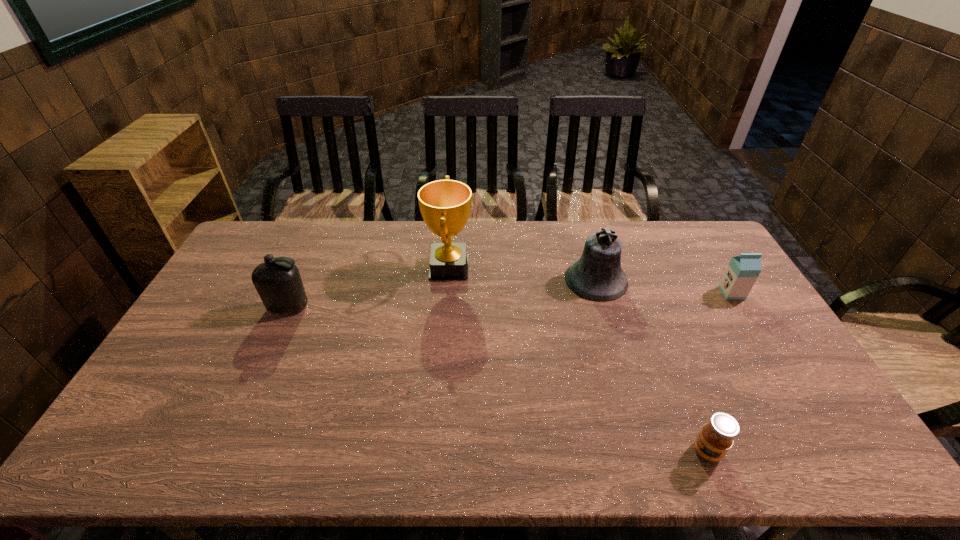
At what (x,y) coordinates should I click in order to perform the action: click on empty space between the award and the leftmost object. Please return your answer as a coordinate pair (x, y). The height and width of the screenshot is (540, 960). Looking at the image, I should click on (369, 287).

The height and width of the screenshot is (540, 960). In order to click on free spot between the fourth object from left to right and the bottle in this screenshot , I will do `click(497, 380)`.

You are a GUI agent. You are given a task and a screenshot of the screen. Output one action in this format:
    pyautogui.click(x=<x>, y=<y>)
    Task: Click on the free area in between the fourth tallest object and the leftmost object
    The width and height of the screenshot is (960, 540).
    Given the screenshot: What is the action you would take?
    pyautogui.click(x=510, y=300)

You are a GUI agent. You are given a task and a screenshot of the screen. Output one action in this format:
    pyautogui.click(x=<x>, y=<y>)
    Task: Click on the object that is the third nearest to the second object from right to left
    The image size is (960, 540).
    Given the screenshot: What is the action you would take?
    pos(445,205)

In order to click on object that is the fourth closest to the leftmost object in this screenshot , I will do `click(742, 271)`.

The image size is (960, 540). I want to click on vacant space that satisfies the following two spatial constraints: 1. on the front-facing side of the tallest object; 2. on the back side of the bell, so click(x=448, y=280).

Image resolution: width=960 pixels, height=540 pixels. Identify the location of vacant space that satisfies the following two spatial constraints: 1. on the front-facing side of the award; 2. on the left side of the rightmost object. (447, 293).

At what (x,y) coordinates should I click in order to perform the action: click on vacant space that satisfies the following two spatial constraints: 1. on the back side of the third object from left to right; 2. on the left side of the bottle. Please return your answer as a coordinate pair (x, y). Looking at the image, I should click on (300, 280).

The height and width of the screenshot is (540, 960). I want to click on free space that satisfies the following two spatial constraints: 1. on the front-facing side of the second object from left to right; 2. on the back side of the fourth tallest object, so click(x=447, y=293).

Locate an element on the screen. blank area in the image that satisfies the following two spatial constraints: 1. on the front-facing side of the award; 2. on the right side of the bell is located at coordinates (448, 280).